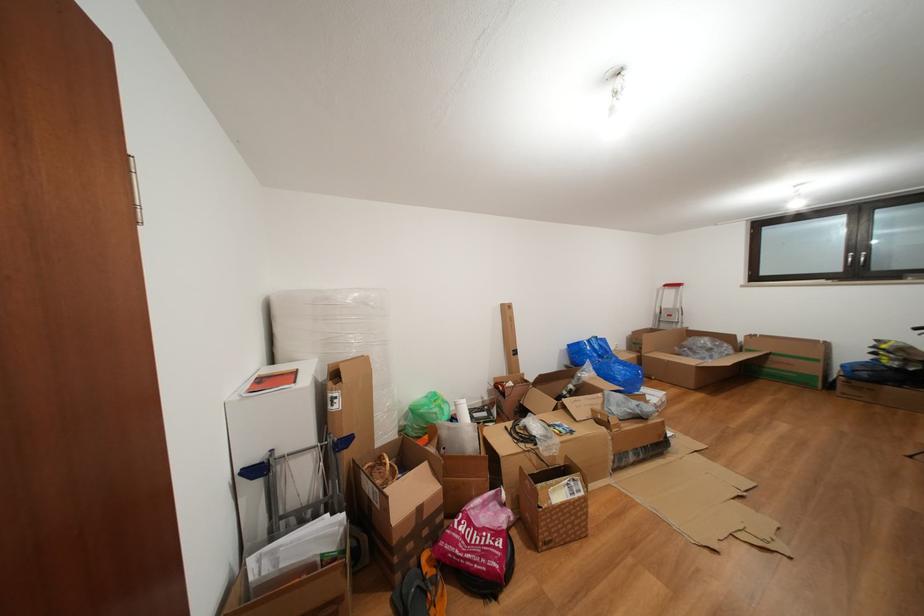
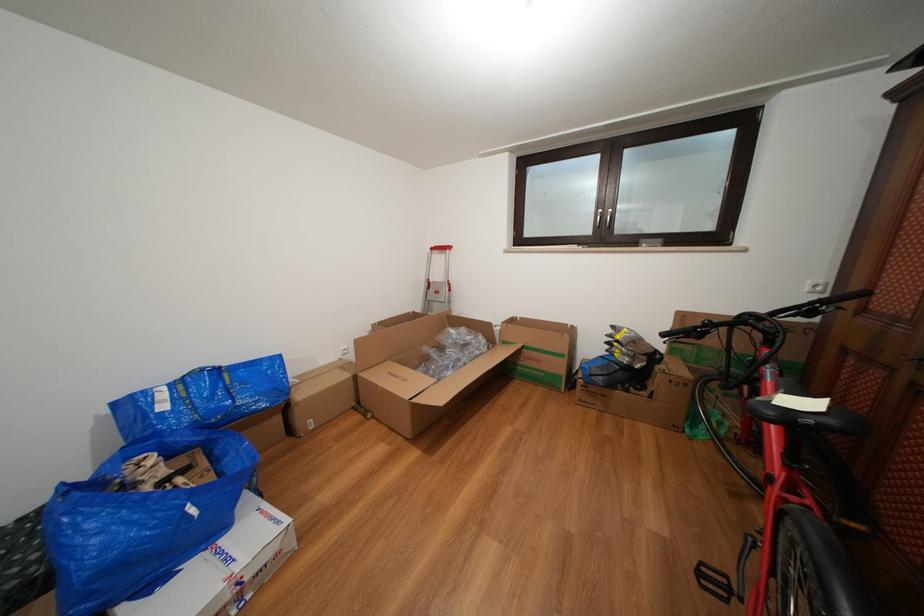
The point at [824,366] is marked in the first image. Where is the corresponding point in the second image?

(570, 361)